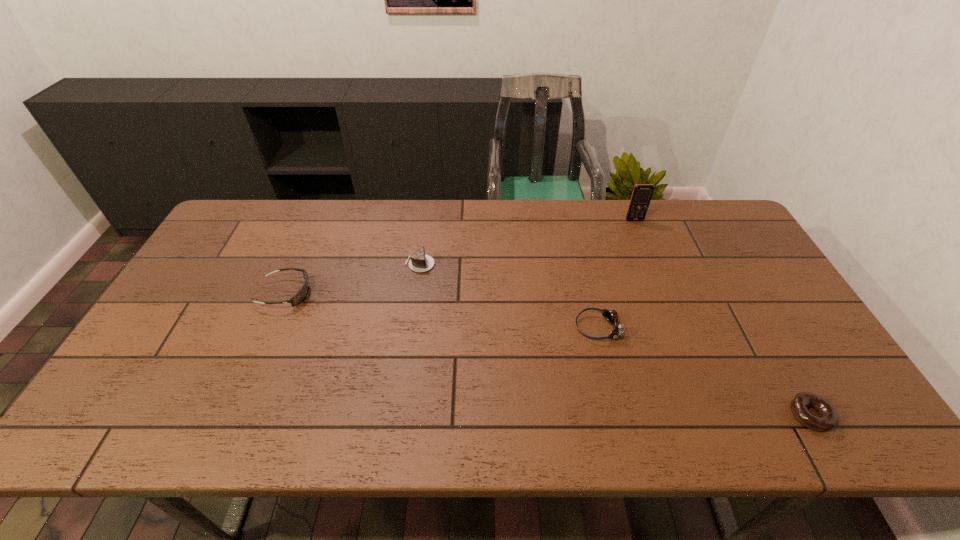
The image size is (960, 540). I want to click on vacant point located between the doughnut and the cellular telephone, so click(x=723, y=318).

Locate an element on the screen. The image size is (960, 540). vacant area between the fourth object from right to left and the third nearest object is located at coordinates (353, 279).

Find the location of a particular element. This screenshot has height=540, width=960. blank region between the right goggles and the left goggles is located at coordinates (442, 310).

Find the location of `free space between the second object from left to right and the farthest object`. free space between the second object from left to right and the farthest object is located at coordinates (527, 242).

Where is `empty space that is in between the farthest object and the third nearest object`? empty space that is in between the farthest object and the third nearest object is located at coordinates (460, 256).

At what (x,y) coordinates should I click in order to perform the action: click on empty location between the leftmost object and the third object from right to left. Please return your answer as a coordinate pair (x, y). Image resolution: width=960 pixels, height=540 pixels. Looking at the image, I should click on (442, 310).

I want to click on vacant point located between the left goggles and the second object from right to left, so click(460, 256).

Choose which object is the fourth nearest neighbor to the rightmost object. Please provide its 2D coordinates. Your answer should be formatted as a tuple, i.e. [(x, y)], where the tuple contains the x and y coordinates of a point satisfying the conditions above.

[(302, 293)]

Identify which object is located as the nearest to the right goggles. Please provide its 2D coordinates. Your answer should be formatted as a tuple, i.e. [(x, y)], where the tuple contains the x and y coordinates of a point satisfying the conditions above.

[(828, 419)]

Where is `free point that satisfies the following two spatial constraints: 1. on the screen of the farthest object; 2. through the lenses of the second nearest object`? The image size is (960, 540). free point that satisfies the following two spatial constraints: 1. on the screen of the farthest object; 2. through the lenses of the second nearest object is located at coordinates (x=678, y=328).